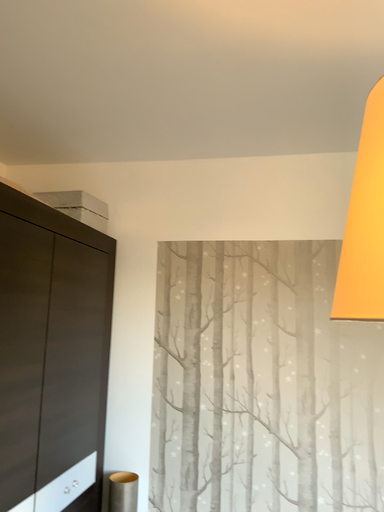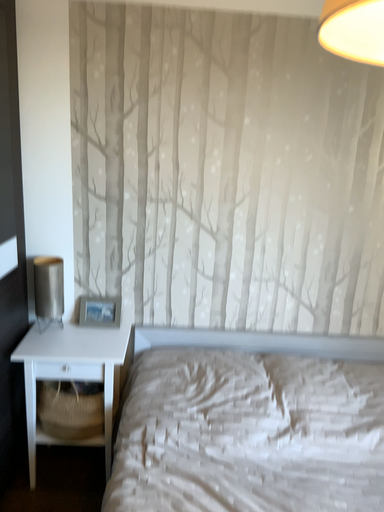
Question: Which way did the camera rotate in the video?

Choices:
 (A) rotated left
 (B) rotated right

Answer: (B)